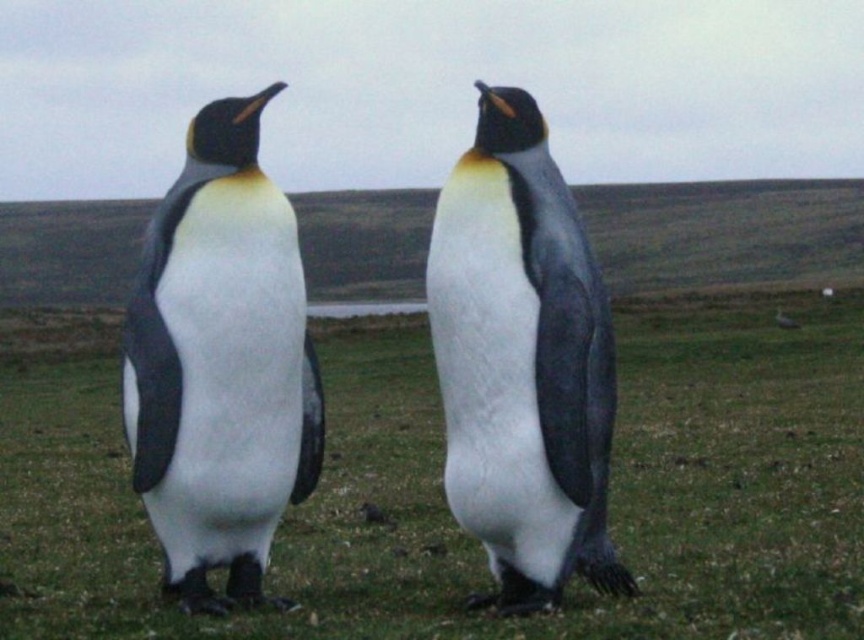
You are a photographer trying to capture a clear shot of the white matte penguin at left and the green grass at center. Which object is taller so that it might block the view of the other?

The white matte penguin at left is taller than the green grass at center, so it might block the view of the green grass at center.

You are a photographer aiming to capture a closeup of the green grass at center. Your camera has a minimum focusing distance of 2 meters. Can you take the photo without moving closer than 2 meters?

The distance of green grass at center from camera is 3.01 meters, which is beyond the camera minimum focusing distance of 2 meters. Therefore, you can take the photo without moving closer than 2 meters.

You are a photographer trying to capture a clear shot of the matte black penguin at center. Since the green grass at center is directly below it, will the penguin be visible against the grass?

The green grass at center is positioned under the matte black penguin at center, so the penguin will be visible as the black plumage contrasts with the green grass.